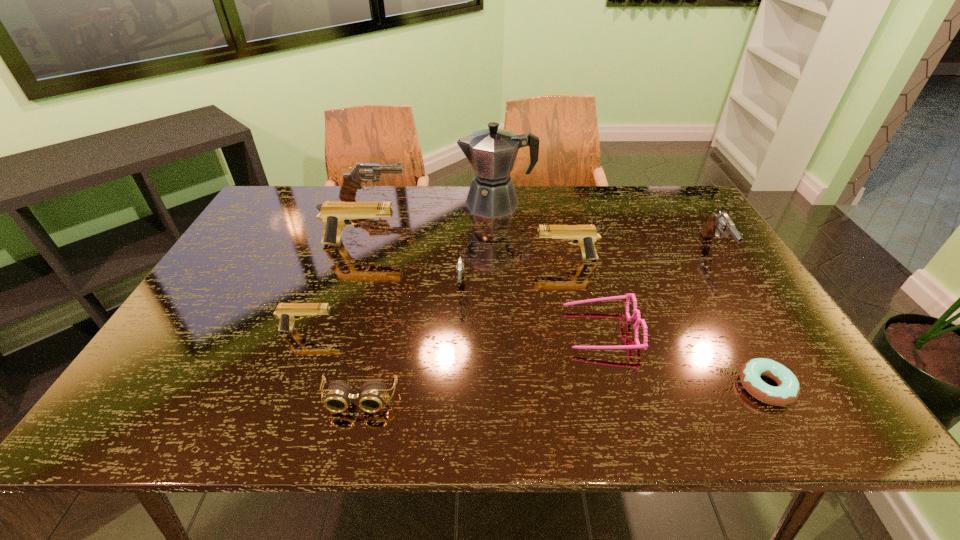
Image resolution: width=960 pixels, height=540 pixels. I want to click on free space between the pink spectacles and the tallest object, so click(548, 267).

This screenshot has width=960, height=540. In order to click on empty space between the farthest tan pistol and the spectacles in this screenshot , I will do `click(480, 287)`.

This screenshot has width=960, height=540. In order to click on object that is the third closest to the fifth pistol from left to right in this screenshot , I will do `click(460, 266)`.

At what (x,y) coordinates should I click in order to perform the action: click on object that stands as the eighth closest to the biggest tan pistol. Please return your answer as a coordinate pair (x, y). Looking at the image, I should click on (788, 389).

I want to click on pistol identified as the third closest to the brown goggles, so click(x=335, y=215).

Locate which pistol is the fifth closest to the farthest tan pistol. Please provide its 2D coordinates. Your answer should be formatted as a tuple, i.e. [(x, y)], where the tuple contains the x and y coordinates of a point satisfying the conditions above.

[(722, 223)]

Image resolution: width=960 pixels, height=540 pixels. I want to click on gray pistol that can be found as the second closest to the shortest object, so click(460, 266).

You are a GUI agent. You are given a task and a screenshot of the screen. Output one action in this format:
    pyautogui.click(x=<x>, y=<y>)
    Task: Click on the gray pistol identified as the closest to the coffeepot
    The width and height of the screenshot is (960, 540).
    Given the screenshot: What is the action you would take?
    pyautogui.click(x=363, y=172)

Find the location of a particular element. This screenshot has width=960, height=540. tan pistol that stands as the closest to the coffeepot is located at coordinates (585, 236).

Where is `tan pistol that stands as the second closest to the smallest gray pistol`? tan pistol that stands as the second closest to the smallest gray pistol is located at coordinates (335, 215).